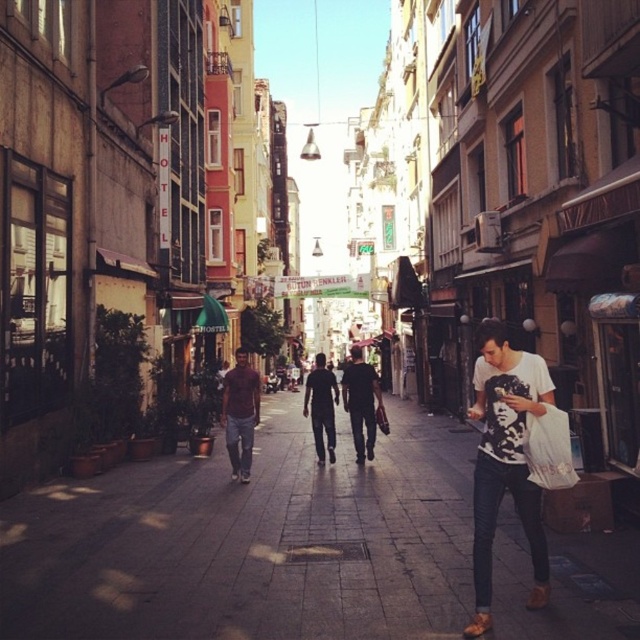
Question: Is matte brown shirt at center to the left of dark blue jeans at center from the viewer's perspective?

Choices:
 (A) yes
 (B) no

Answer: (A)

Question: Which of the following is the closest to the observer?

Choices:
 (A) dark gray fabric jacket at center
 (B) matte brown shirt at center
 (C) smooth concrete pavement at center

Answer: (C)

Question: Based on their relative distances, which object is farther from the dark gray fabric jacket at center?

Choices:
 (A) white printed t-shirt at center-right
 (B) dark blue jeans at center
 (C) smooth concrete pavement at center

Answer: (A)

Question: Is white printed t-shirt at center-right positioned in front of dark gray fabric jacket at center?

Choices:
 (A) no
 (B) yes

Answer: (B)

Question: Is matte brown shirt at center smaller than dark blue jeans at center?

Choices:
 (A) yes
 (B) no

Answer: (B)

Question: Among these objects, which one is nearest to the camera?

Choices:
 (A) white printed t-shirt at center-right
 (B) smooth concrete pavement at center

Answer: (B)